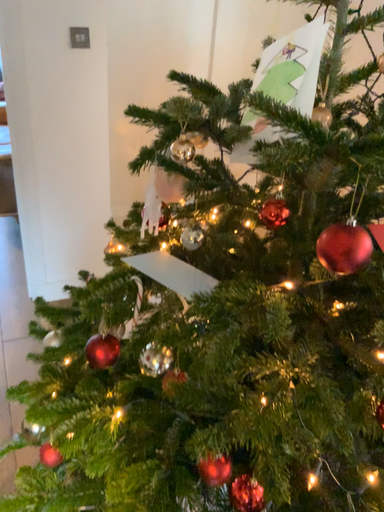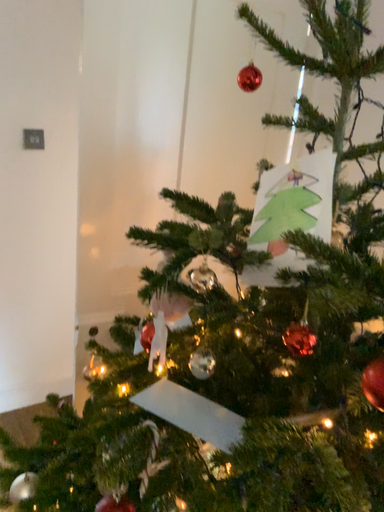
Question: How did the camera likely rotate when shooting the video?

Choices:
 (A) rotated downward
 (B) rotated upward

Answer: (B)